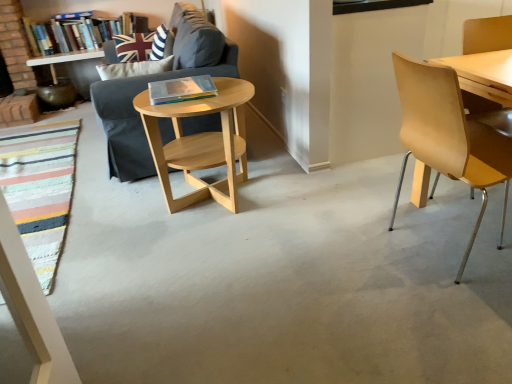
Question: From a real-world perspective, is light wood/woodenobject at center physically located above or below hardcover book at upper left, which is the first book in top-to-bottom order?

Choices:
 (A) below
 (B) above

Answer: (A)

Question: In the image, is light wood/woodenobject at center on the left side or the right side of hardcover book at upper left, which is the first book in top-to-bottom order?

Choices:
 (A) right
 (B) left

Answer: (A)

Question: Considering the real-world distances, which object is farthest from the hardcover book at upper left, the 2th book from the right?

Choices:
 (A) light wood/woodenobject at center
 (B) hardcover book at center, the first book in the bottom-to-top sequence
 (C) dark gray fabric couch at center-left
 (D) union jack fabric pillow at upper left
 (E) light brown wood chair at right

Answer: (E)

Question: Which of these objects is positioned farthest from the hardcover book at center, acting as the 2th book starting from the top?

Choices:
 (A) dark gray fabric couch at center-left
 (B) light brown wood chair at right
 (C) light wood/woodenobject at center
 (D) union jack fabric pillow at upper left
 (E) hardcover book at upper left, which appears as the 2th book when ordered from the bottom

Answer: (E)